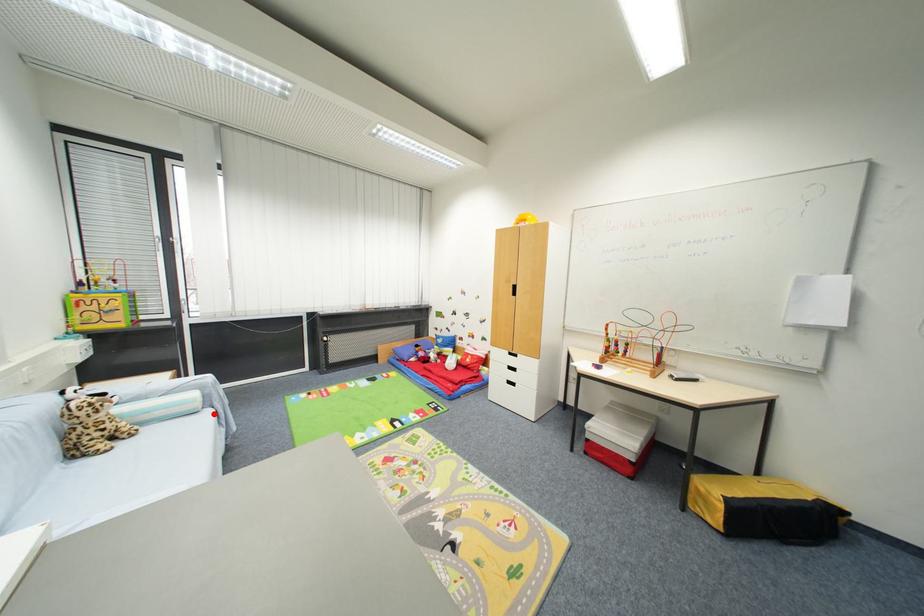
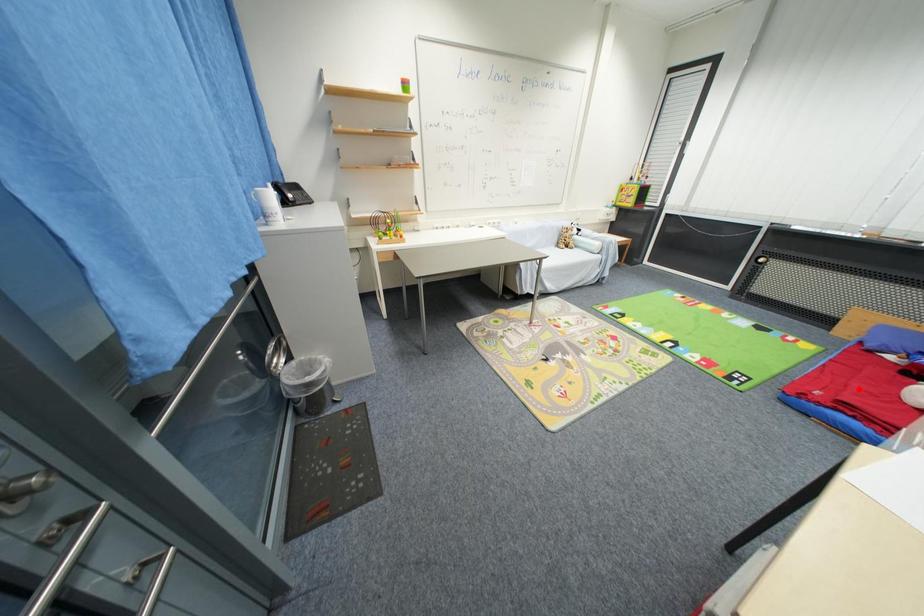
I am providing you with two images of the same scene from different viewpoints. A red point is marked on the first image and another point is marked on the second image. Do the highlighted points in image1 and image2 indicate the same real-world spot?

No